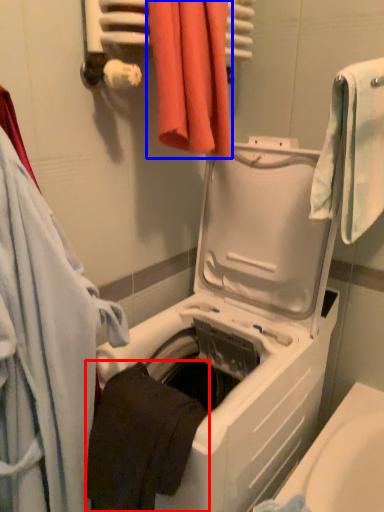
Question: Among these objects, which one is farthest to the camera, towel (highlighted by a red box) or towel (highlighted by a blue box)?

Choices:
 (A) towel
 (B) towel

Answer: (B)